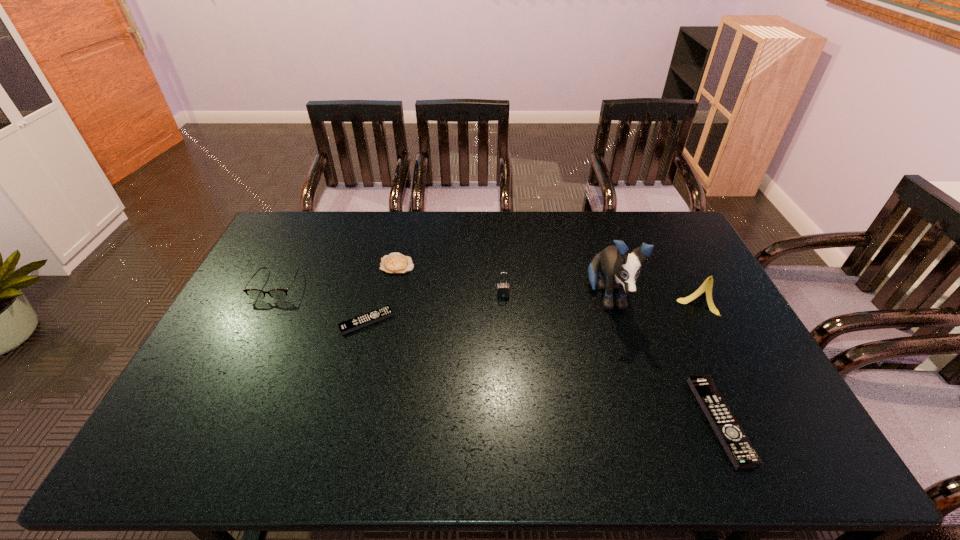
Find the location of a particular element. This screenshot has width=960, height=540. object that is at the left edge is located at coordinates (255, 294).

Locate an element on the screen. The width and height of the screenshot is (960, 540). remote control present at the right edge is located at coordinates (739, 449).

What are the coordinates of `banana located at the right edge` in the screenshot? It's located at [707, 285].

Where is `object located at the near right corner`? This screenshot has height=540, width=960. object located at the near right corner is located at coordinates (739, 449).

The image size is (960, 540). What are the coordinates of `vacant space at the far edge of the desktop` in the screenshot? It's located at pyautogui.click(x=376, y=240).

The width and height of the screenshot is (960, 540). What are the coordinates of `vacant space at the near edge of the desktop` in the screenshot? It's located at (574, 407).

Identify the location of free space at the left edge of the desktop. Image resolution: width=960 pixels, height=540 pixels. (287, 274).

In the image, there is a desktop. What are the coordinates of `free region at the right edge` in the screenshot? It's located at (672, 254).

Locate an element on the screen. vacant area at the far right corner of the desktop is located at coordinates (668, 221).

Locate an element on the screen. Image resolution: width=960 pixels, height=540 pixels. empty space between the quiche and the padlock is located at coordinates (450, 280).